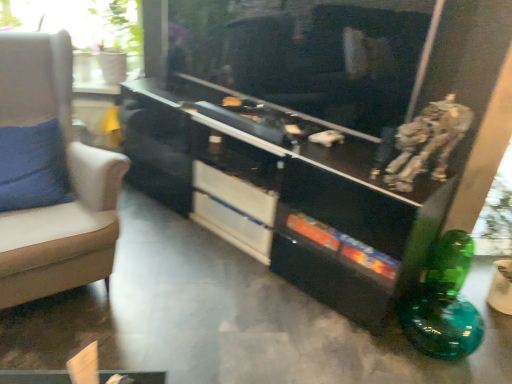
Question: From a real-world perspective, relative to white glossy drawer at center, arranged as the first drawer when ordered from the bottom, is white glossy drawer at center, which is the first drawer from top to bottom, vertically above or below?

Choices:
 (A) above
 (B) below

Answer: (A)

Question: In the image, is white glossy drawer at center, arranged as the 2th drawer when ordered from the bottom, on the left side or the right side of white glossy drawer at center, arranged as the first drawer when ordered from the bottom?

Choices:
 (A) left
 (B) right

Answer: (B)

Question: Considering the real-world distances, which object is farthest from the transparent glass window at upper left?

Choices:
 (A) white glossy drawer at center, which is the first drawer from top to bottom
 (B) black glossy entertainment center at center
 (C) beige fabric chair at left
 (D) white glossy drawer at center, arranged as the first drawer when ordered from the bottom
 (E) metallic silver robot at upper right

Answer: (E)

Question: Which of these objects is positioned farthest from the black glossy entertainment center at center?

Choices:
 (A) white glossy drawer at center, arranged as the first drawer when ordered from the bottom
 (B) beige fabric chair at left
 (C) white glossy drawer at center, arranged as the 2th drawer when ordered from the bottom
 (D) transparent glass window at upper left
 (E) metallic silver robot at upper right

Answer: (D)